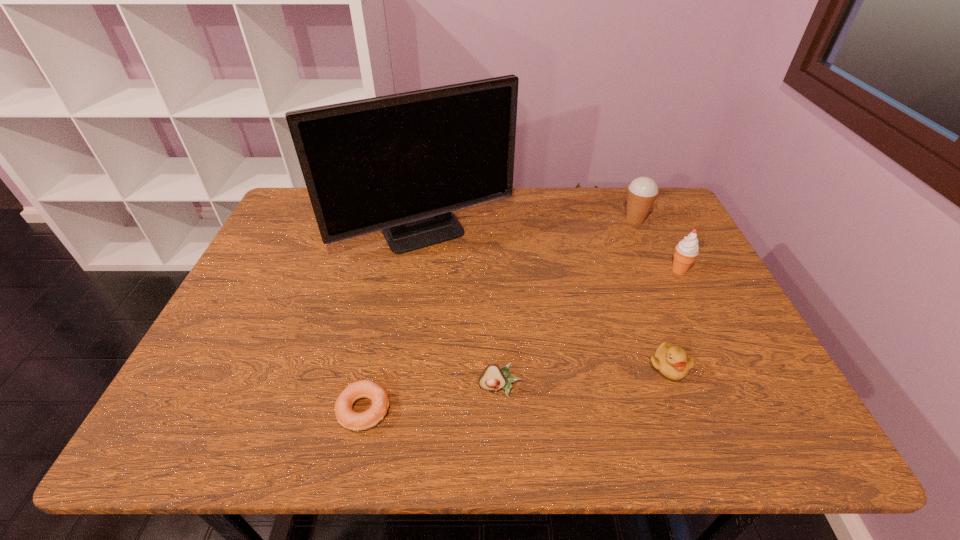
Where is `the tallest object`? the tallest object is located at coordinates (401, 163).

Image resolution: width=960 pixels, height=540 pixels. Identify the location of the farther icecream. (642, 192).

You are a GUI agent. You are given a task and a screenshot of the screen. Output one action in this format:
    pyautogui.click(x=<x>, y=<y>)
    Task: Click on the nearer icecream
    Image resolution: width=960 pixels, height=540 pixels.
    Given the screenshot: What is the action you would take?
    [687, 250]

Locate an element on the screen. Image resolution: width=960 pixels, height=540 pixels. avocado is located at coordinates (492, 378).

Identify the location of the second shortest object. (671, 361).

At what (x,y) coordinates should I click in order to perform the action: click on the shortest object. Please return your answer as a coordinate pair (x, y). Looking at the image, I should click on (354, 421).

The height and width of the screenshot is (540, 960). What are the coordinates of `free space located 0.090m on the front-facing side of the computer monitor` in the screenshot? It's located at (418, 286).

At what (x,y) coordinates should I click in order to perform the action: click on free point located on the back of the farther icecream. Please return your answer as a coordinate pair (x, y). Looking at the image, I should click on (621, 188).

This screenshot has height=540, width=960. Identify the location of vacant space located 0.060m on the right of the nearer icecream. (711, 270).

Where is `vacant region located 0.080m on the seed side of the fourth tallest object`? This screenshot has width=960, height=540. vacant region located 0.080m on the seed side of the fourth tallest object is located at coordinates pos(501,435).